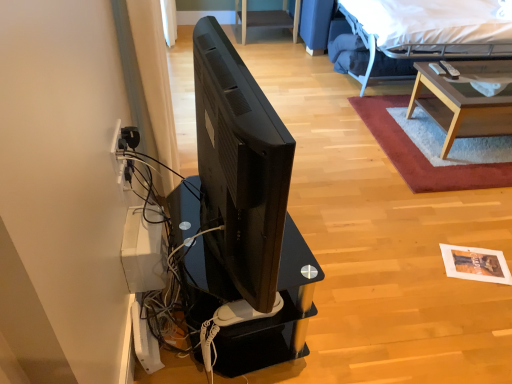
Identify the location of black matte television at center. The height and width of the screenshot is (384, 512). (240, 166).

Describe the element at coordinates (119, 161) in the screenshot. I see `white plastic electric outlet at left` at that location.

Image resolution: width=512 pixels, height=384 pixels. Identify the location of light brown wooden table at upper right. (464, 101).

Find the location of a particular element. black matte television at center is located at coordinates point(240,166).

Image resolution: width=512 pixels, height=384 pixels. I want to click on television on the left of black glossy desk at center, so click(240, 166).

Considering the positions of objects black glossy desk at center and black matte television at center in the image provided, who is behind, black glossy desk at center or black matte television at center?

black glossy desk at center is more distant.

Is black glossy desk at center to the left of black matte television at center from the viewer's perspective?

No, black glossy desk at center is not to the left of black matte television at center.

Is black glossy desk at center far away from black matte television at center?

No, black glossy desk at center is in close proximity to black matte television at center.

Is black glossy desk at center aimed at white fabric bed at upper right?

No.

Between black glossy desk at center and white fabric bed at upper right, which one appears on the left side from the viewer's perspective?

black glossy desk at center is more to the left.

Does point (205, 293) come in front of point (401, 49)?

Yes, point (205, 293) is in front of point (401, 49).

This screenshot has height=384, width=512. In the image, there is a black glossy desk at center. In order to click on bed above it (from the image's perspective) in this screenshot , I will do `click(432, 28)`.

From the image's perspective, which object appears higher, white fabric bed at upper right or black glossy desk at center?

white fabric bed at upper right appears higher in the image.

From their relative heights in the image, would you say white fabric bed at upper right is taller or shorter than black glossy desk at center?

Clearly, white fabric bed at upper right is taller compared to black glossy desk at center.

Does white fabric bed at upper right have a smaller size compared to black glossy desk at center?

Incorrect, white fabric bed at upper right is not smaller in size than black glossy desk at center.

Which is correct: light brown wooden table at upper right is inside white plastic electric outlet at left, or outside of it?

light brown wooden table at upper right is not enclosed by white plastic electric outlet at left.

Measure the distance from light brown wooden table at upper right to white plastic electric outlet at left.

light brown wooden table at upper right is 6.67 feet from white plastic electric outlet at left.

Who is shorter, light brown wooden table at upper right or white plastic electric outlet at left?

white plastic electric outlet at left is shorter.

Are light brown wooden table at upper right and white plastic electric outlet at left making contact?

No, light brown wooden table at upper right is not touching white plastic electric outlet at left.

You are a GUI agent. You are given a task and a screenshot of the screen. Output one action in this format:
    pyautogui.click(x=<x>, y=<y>)
    Task: Click on the table behind the black matte television at center
    The width and height of the screenshot is (512, 384).
    Given the screenshot: What is the action you would take?
    pyautogui.click(x=464, y=101)

Considering the sizes of objects black matte television at center and light brown wooden table at upper right in the image provided, who is shorter, black matte television at center or light brown wooden table at upper right?

light brown wooden table at upper right.

Would you say light brown wooden table at upper right is part of black matte television at center's contents?

No, light brown wooden table at upper right is not inside black matte television at center.

Who is smaller, black matte television at center or light brown wooden table at upper right?

Smaller between the two is black matte television at center.

In the image, is shaggy red rug at upper right positioned in front of or behind light brown wooden table at upper right?

In the image, shaggy red rug at upper right appears behind light brown wooden table at upper right.

Is shaggy red rug at upper right oriented towards light brown wooden table at upper right?

No, shaggy red rug at upper right is not turned towards light brown wooden table at upper right.

Can we say shaggy red rug at upper right lies outside light brown wooden table at upper right?

Yes.

Is point (234, 346) positioned after point (508, 171)?

No, (234, 346) is in front of (508, 171).

Is black glossy desk at center to the left of shaggy red rug at upper right from the viewer's perspective?

Indeed, black glossy desk at center is positioned on the left side of shaggy red rug at upper right.

Considering the sizes of objects black glossy desk at center and shaggy red rug at upper right in the image provided, who is shorter, black glossy desk at center or shaggy red rug at upper right?

Standing shorter between the two is shaggy red rug at upper right.

In terms of size, does black glossy desk at center appear bigger or smaller than shaggy red rug at upper right?

Clearly, black glossy desk at center is smaller in size than shaggy red rug at upper right.

This screenshot has height=384, width=512. I want to click on desk on the right side of black matte television at center, so click(x=275, y=315).

Locate an element on the screen. desk that is under the white fabric bed at upper right (from a real-world perspective) is located at coordinates (275, 315).

Based on their spatial positions, is black glossy desk at center or white fabric bed at upper right closer to white plastic electric outlet at left?

Based on the image, black glossy desk at center appears to be nearer to white plastic electric outlet at left.

Which object lies further to the anchor point black glossy desk at center, black matte television at center or white fabric bed at upper right?

The object further to black glossy desk at center is white fabric bed at upper right.

When comparing their distances from shaggy red rug at upper right, does white plastic electric outlet at left or white fabric bed at upper right seem closer?

white fabric bed at upper right is closer to shaggy red rug at upper right.

Which object lies further to the anchor point black glossy desk at center, white plastic electric outlet at left or white fabric bed at upper right?

The object further to black glossy desk at center is white fabric bed at upper right.

Estimate the real-world distances between objects in this image. Which object is closer to shaggy red rug at upper right, white plastic electric outlet at left or light brown wooden table at upper right?

Among the two, light brown wooden table at upper right is located nearer to shaggy red rug at upper right.

Looking at the image, which one is located further to white plastic electric outlet at left, black matte television at center or black glossy desk at center?

Among the two, black matte television at center is located further to white plastic electric outlet at left.

Based on their spatial positions, is light brown wooden table at upper right or shaggy red rug at upper right further from white plastic electric outlet at left?

Among the two, light brown wooden table at upper right is located further to white plastic electric outlet at left.

In the scene shown: Estimate the real-world distances between objects in this image. Which object is further from black glossy desk at center, shaggy red rug at upper right or white fabric bed at upper right?

white fabric bed at upper right.

You are a GUI agent. You are given a task and a screenshot of the screen. Output one action in this format:
    pyautogui.click(x=<x>, y=<y>)
    Task: Click on the desk between white plastic electric outlet at left and light brown wooden table at upper right from left to right
    
    Given the screenshot: What is the action you would take?
    pyautogui.click(x=275, y=315)

Identify the location of television between white fabric bed at upper right and black glossy desk at center vertically. (240, 166).

Locate an element on the screen. desk between black matte television at center and shaggy red rug at upper right is located at coordinates (275, 315).

Where is `desk positioned between black matte television at center and white plastic electric outlet at left from near to far`? The width and height of the screenshot is (512, 384). desk positioned between black matte television at center and white plastic electric outlet at left from near to far is located at coordinates (275, 315).